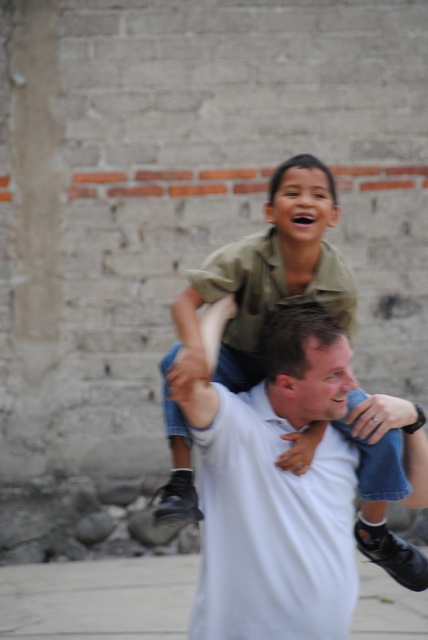
Is white cotton shirt at center above gray concrete pavement at lower center?

Yes, white cotton shirt at center is above gray concrete pavement at lower center.

Does point (291, 476) come closer to viewer compared to point (365, 593)?

Yes, point (291, 476) is in front of point (365, 593).

Between point (244, 433) and point (98, 577), which one is positioned in front?

Point (244, 433) is more forward.

Locate an element on the screen. This screenshot has width=428, height=640. white cotton shirt at center is located at coordinates (276, 497).